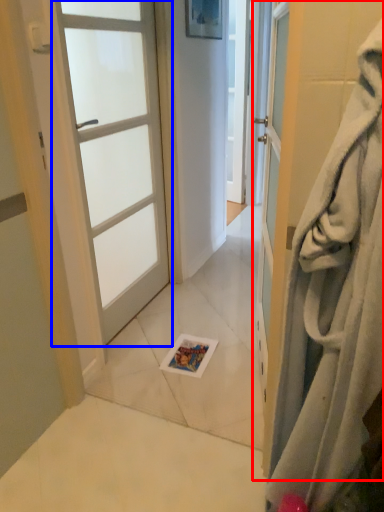
Question: Among these objects, which one is farthest to the camera, door (highlighted by a red box) or door (highlighted by a blue box)?

Choices:
 (A) door
 (B) door

Answer: (B)